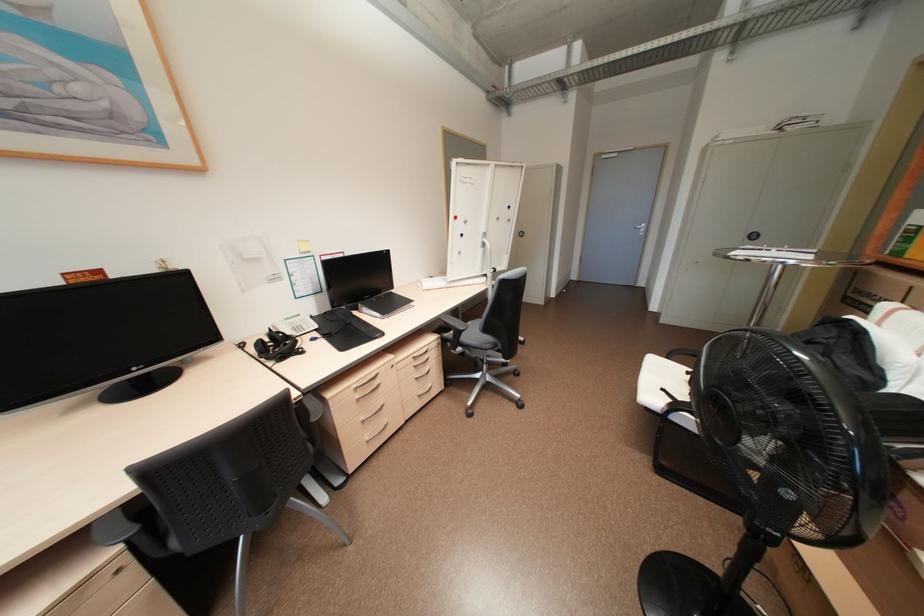
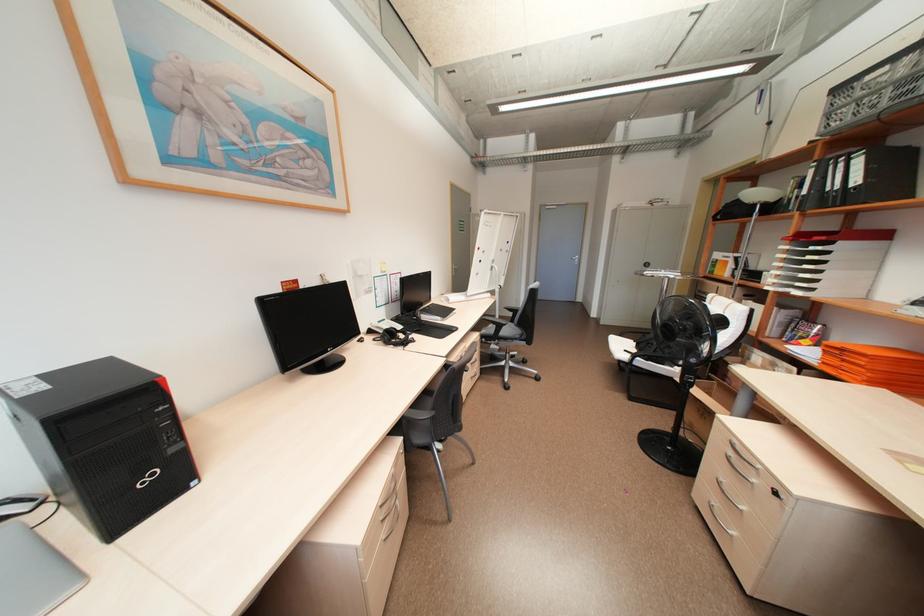
In the second image, find the point that corresponds to [292,318] in the first image.

(384, 322)